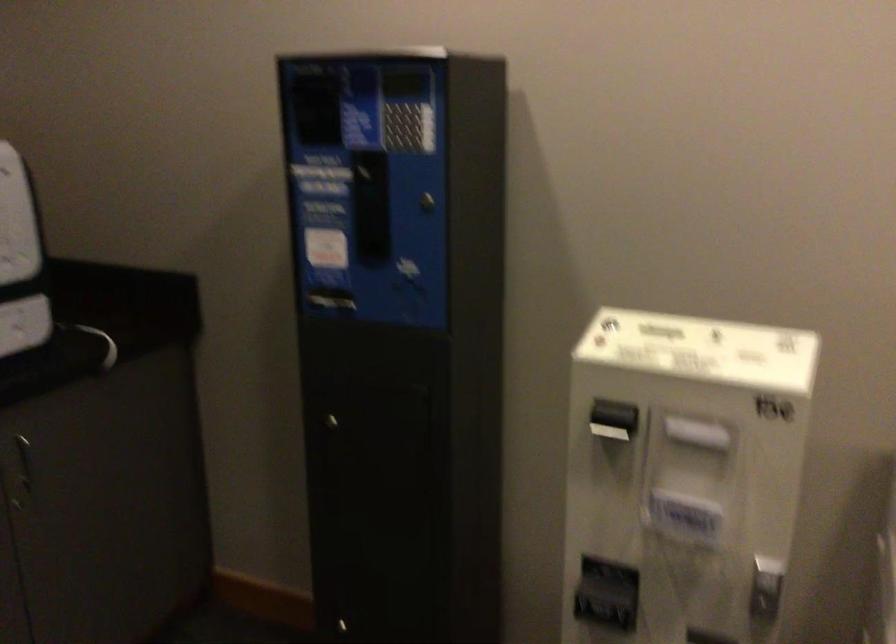
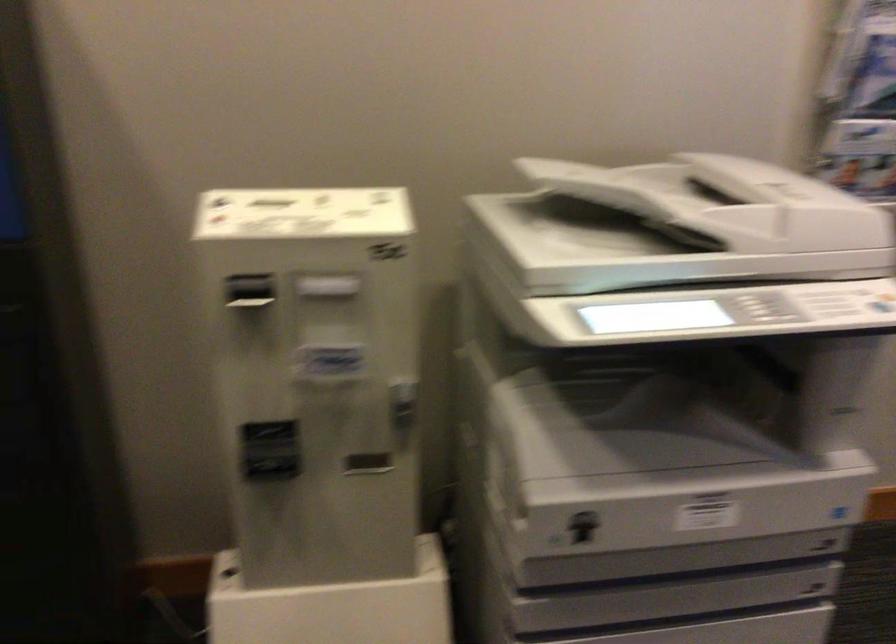
Find the pixel in the second image that matches [606,420] in the first image.

(250, 292)